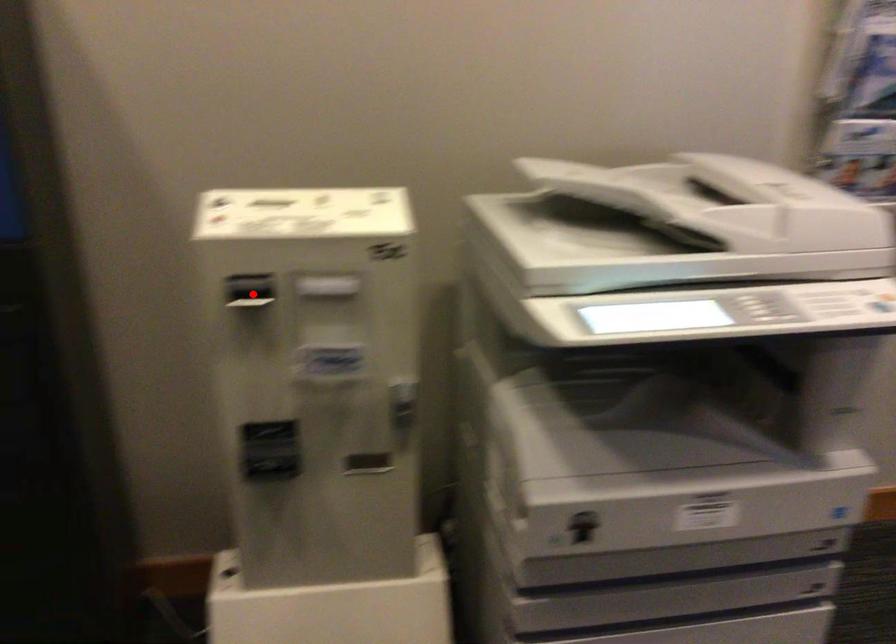
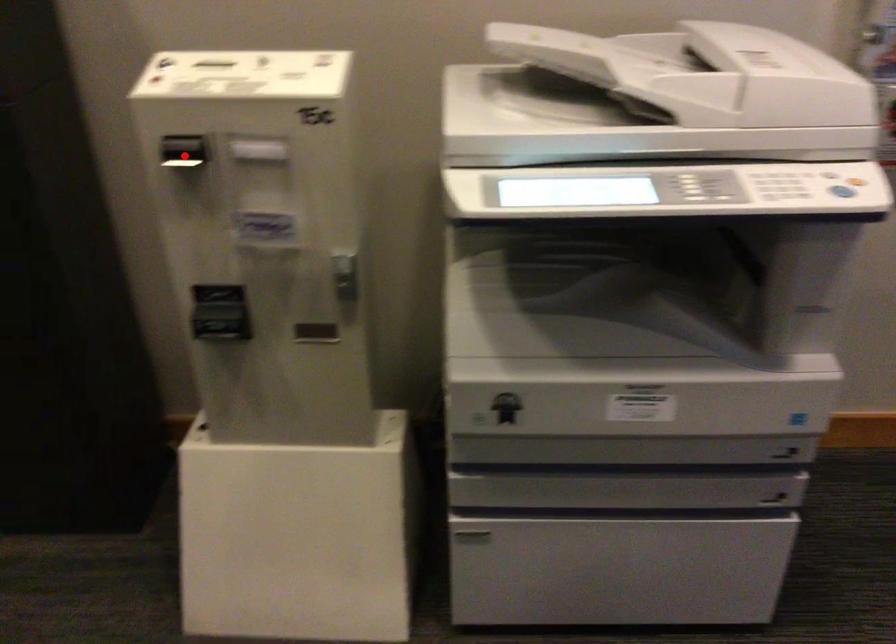
I am providing you with two images of the same scene from different viewpoints. A red point is marked on the first image and another point is marked on the second image. Is the marked point in image1 the same physical position as the marked point in image2?

Yes